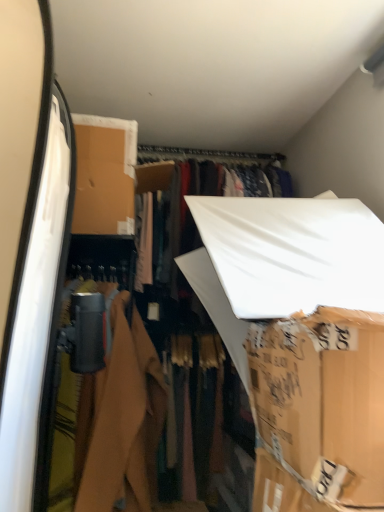
Image resolution: width=384 pixels, height=512 pixels. Describe the element at coordinates (319, 410) in the screenshot. I see `brown cardboard box at center` at that location.

You are a GUI agent. You are given a task and a screenshot of the screen. Output one action in this format:
    pyautogui.click(x=<x>, y=<y>)
    Task: Click on the brown cardboard box at center
    
    Given the screenshot: What is the action you would take?
    pyautogui.click(x=319, y=410)

In order to click on matte black camera at left in this screenshot , I will do `click(106, 423)`.

What do you see at coordinates (106, 423) in the screenshot? I see `matte black camera at left` at bounding box center [106, 423].

The image size is (384, 512). Find the location of `brown cardboard box at center`. brown cardboard box at center is located at coordinates point(319,410).

Does brown cardboard box at center appear on the left side of matte black camera at left?

Incorrect, brown cardboard box at center is not on the left side of matte black camera at left.

Looking at this image, is the position of brown cardboard box at center less distant than that of matte black camera at left?

Yes, it is in front of matte black camera at left.

Is point (320, 357) positioned after point (140, 340)?

No, it is in front of (140, 340).

From the image's perspective, between brown cardboard box at center and matte black camera at left, which one is located above?

brown cardboard box at center appears higher in the image.

From a real-world perspective, who is located lower, brown cardboard box at center or matte black camera at left?

matte black camera at left.

Considering the relative sizes of brown cardboard box at center and matte black camera at left in the image provided, is brown cardboard box at center wider than matte black camera at left?

No, brown cardboard box at center is not wider than matte black camera at left.

Who is taller, brown cardboard box at center or matte black camera at left?

With more height is matte black camera at left.

Can you confirm if brown cardboard box at center is bigger than matte black camera at left?

No.

Consider the image. Would you say brown cardboard box at center contains matte black camera at left?

No, matte black camera at left is located outside of brown cardboard box at center.

Is brown cardboard box at center in contact with matte black camera at left?

No, brown cardboard box at center is not making contact with matte black camera at left.

Is brown cardboard box at center oriented towards matte black camera at left?

No.

How many degrees apart are the facing directions of brown cardboard box at center and matte black camera at left?

They differ by 94.1 degrees in their facing directions.

How distant is brown cardboard box at center from matte black camera at left?

brown cardboard box at center and matte black camera at left are 65.96 centimeters apart from each other.

Locate an element on the screen. The height and width of the screenshot is (512, 384). cardboard box above the matte black camera at left (from a real-world perspective) is located at coordinates (319, 410).

Is matte black camera at left at the left side of brown cardboard box at center?

Correct, you'll find matte black camera at left to the left of brown cardboard box at center.

Is matte black camera at left further to the viewer compared to brown cardboard box at center?

Yes, matte black camera at left is behind brown cardboard box at center.

Is point (65, 352) positioned behind point (282, 359)?

Yes, point (65, 352) is behind point (282, 359).

From the image's perspective, is matte black camera at left above or below brown cardboard box at center?

Clearly, from the image's perspective, matte black camera at left is below brown cardboard box at center.

From a real-world perspective, between matte black camera at left and brown cardboard box at center, who is vertically higher?

In real-world perspective, brown cardboard box at center is above.

From the picture: Is matte black camera at left wider or thinner than brown cardboard box at center?

Considering their sizes, matte black camera at left looks broader than brown cardboard box at center.

Which of these two, matte black camera at left or brown cardboard box at center, stands taller?

With more height is matte black camera at left.

Can you confirm if matte black camera at left is bigger than brown cardboard box at center?

Indeed, matte black camera at left has a larger size compared to brown cardboard box at center.

Does matte black camera at left contain brown cardboard box at center?

No.

Consider the image. Is matte black camera at left directly adjacent to brown cardboard box at center?

No, matte black camera at left is not touching brown cardboard box at center.

Consider the image. Is matte black camera at left facing away from brown cardboard box at center?

No, matte black camera at left is not facing the opposite direction of brown cardboard box at center.

This screenshot has height=512, width=384. Find the location of `closet on the left of brown cardboard box at center`. closet on the left of brown cardboard box at center is located at coordinates (106, 423).

Find the location of `closet below the brown cardboard box at center (from a real-world perspective)`. closet below the brown cardboard box at center (from a real-world perspective) is located at coordinates (106, 423).

The image size is (384, 512). I want to click on cardboard box on the right side of matte black camera at left, so click(319, 410).